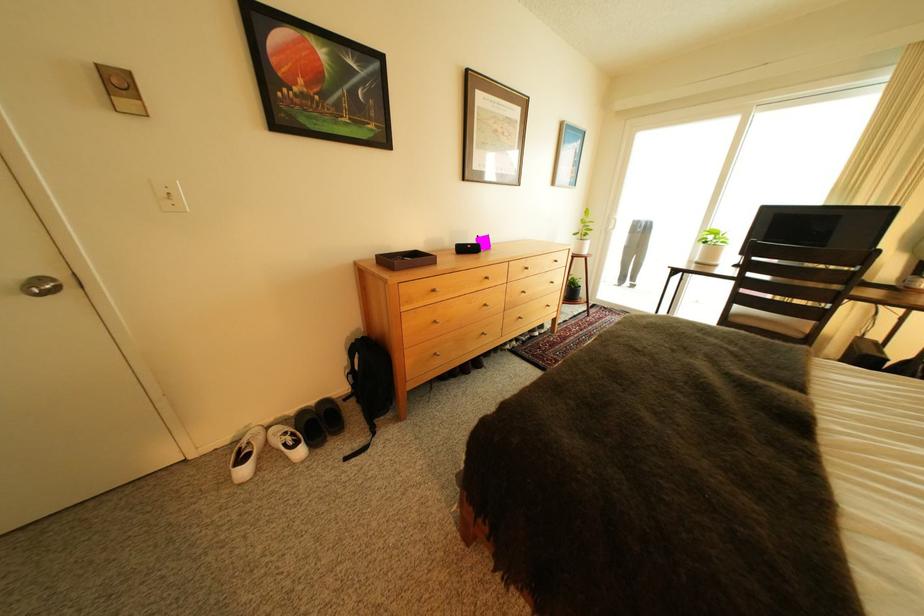
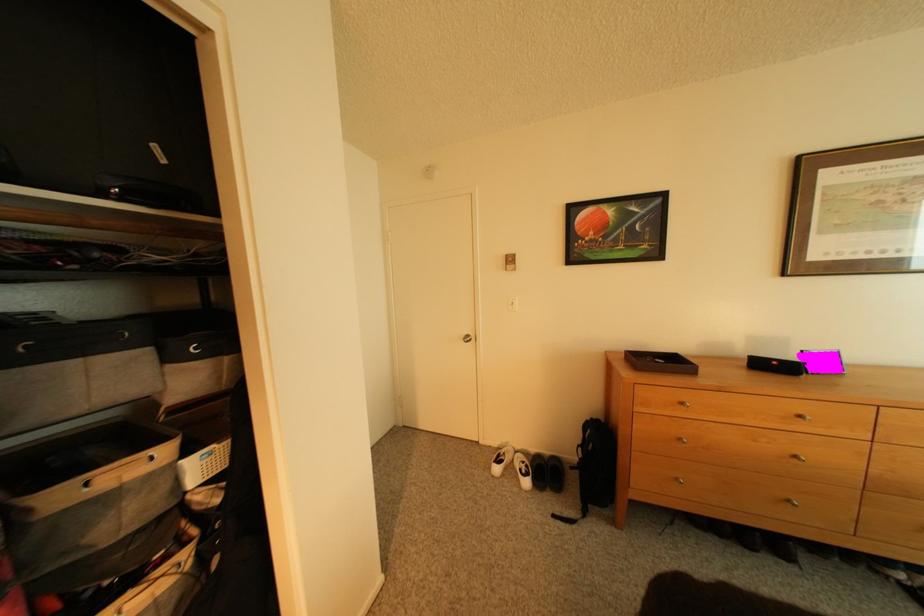
Question: The images are taken continuously from a first-person perspective. In which direction is your viewpoint rotating?

Choices:
 (A) Left
 (B) Right
 (C) Up
 (D) Down

Answer: (A)